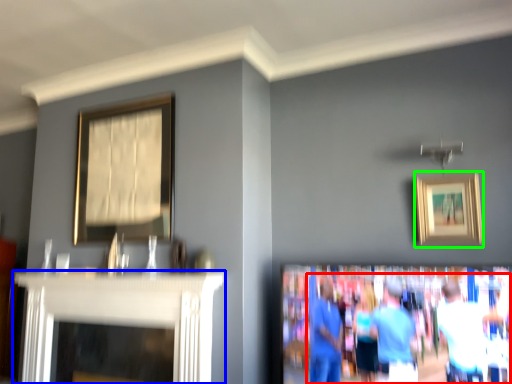
Question: Which is farther away from couple (highlighted by a red box)? fireplace (highlighted by a blue box) or picture frame (highlighted by a green box)?

Choices:
 (A) fireplace
 (B) picture frame

Answer: (A)